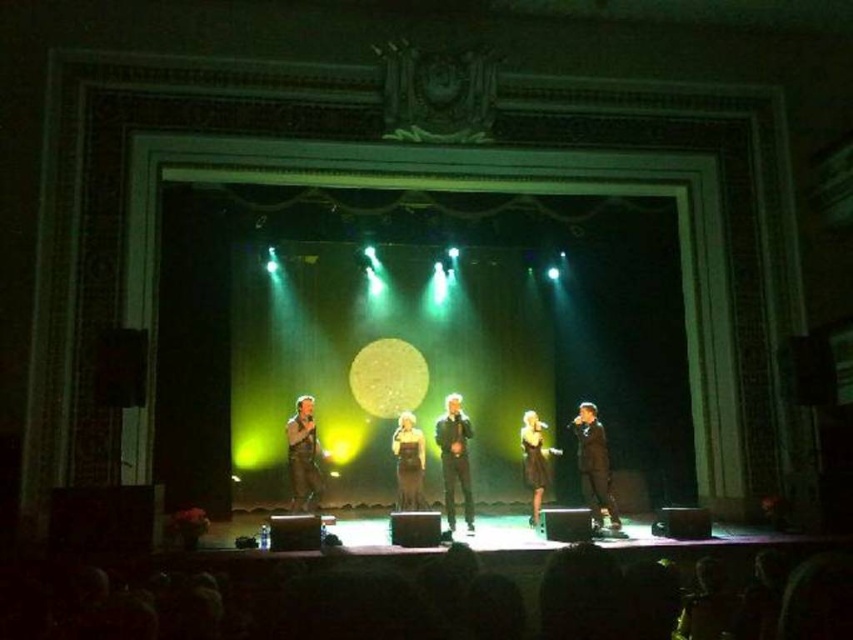
Is black matte suit at center to the right of shiny gold dress at center from the viewer's perspective?

Indeed, black matte suit at center is positioned on the right side of shiny gold dress at center.

Between point (598, 432) and point (418, 502), which one is positioned in front?

Point (598, 432) is more forward.

What do you see at coordinates (595, 465) in the screenshot? Image resolution: width=853 pixels, height=640 pixels. I see `black matte suit at center` at bounding box center [595, 465].

Locate an element on the screen. The width and height of the screenshot is (853, 640). black matte suit at center is located at coordinates (595, 465).

Can you confirm if black matte suit at center is positioned below black satin dress at center?

Actually, black matte suit at center is above black satin dress at center.

Can you confirm if black matte suit at center is positioned above black satin dress at center?

Yes.

Which is behind, point (595, 436) or point (537, 422)?

The point (537, 422) is more distant.

Locate an element on the screen. black matte suit at center is located at coordinates (595, 465).

How distant is black leather jacket at center from black satin dress at center?

black leather jacket at center is 1.01 meters away from black satin dress at center.

The image size is (853, 640). What are the coordinates of `black leather jacket at center` in the screenshot? It's located at (454, 460).

This screenshot has height=640, width=853. I want to click on black leather jacket at center, so click(x=454, y=460).